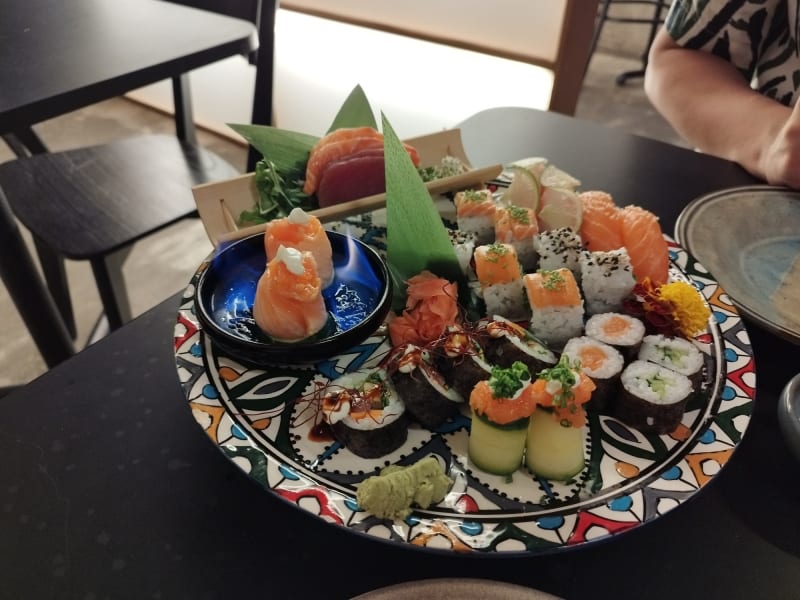
In order to click on wall in this screenshot , I will do `click(529, 12)`.